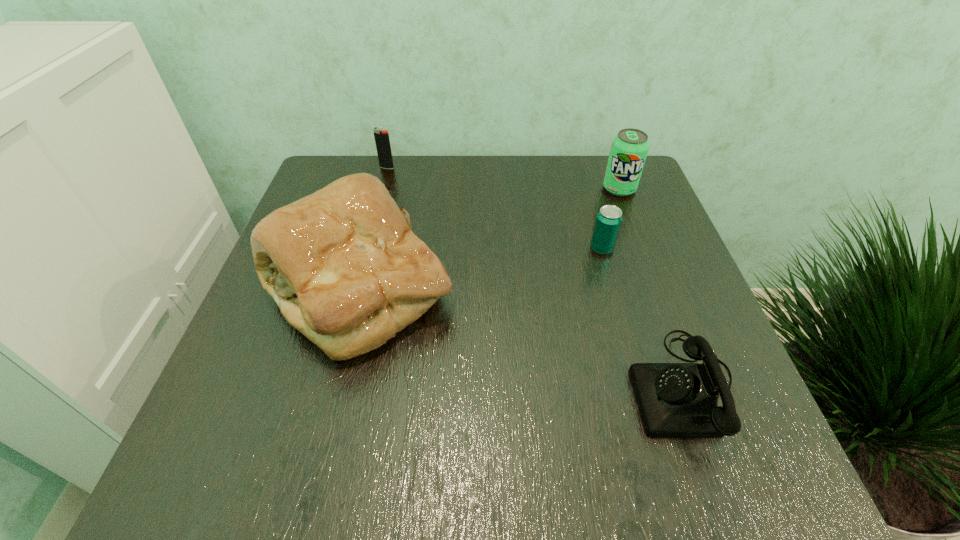
Where is `the tallest object`? the tallest object is located at coordinates (343, 265).

The image size is (960, 540). I want to click on the fourth shortest object, so click(x=629, y=148).

What are the coordinates of `pop soda` in the screenshot? It's located at (629, 148).

In order to click on the farthest object in this screenshot , I will do [382, 141].

Identify the location of beer can. (608, 221).

Where is `telephone`? The image size is (960, 540). telephone is located at coordinates (675, 400).

Locate an element on the screen. free space located on the filling side of the tallest object is located at coordinates (511, 289).

Locate an element on the screen. vacant space situated 0.070m on the front-facing side of the pop soda is located at coordinates (630, 217).

Identify the location of free space located on the right of the farthest object. This screenshot has height=540, width=960. (424, 167).

I want to click on free space located on the back of the beer can, so click(x=591, y=213).